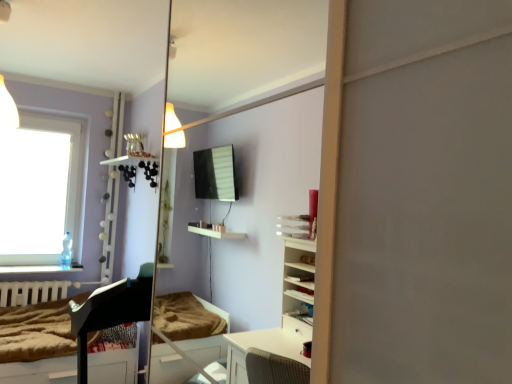
At what (x,y) coordinates should I click in order to perform the action: click on clear glass window at upper left. Please return your answer as a coordinate pair (x, y). The height and width of the screenshot is (384, 512). Looking at the image, I should click on click(42, 191).

Locate an element on the screen. brown textured mattress at lower left is located at coordinates (37, 331).

Describe the element at coordinates (87, 334) in the screenshot. I see `black glossy piano at lower left` at that location.

The width and height of the screenshot is (512, 384). Identify the location of clear glass window at upper left. pyautogui.click(x=42, y=191).

Between black glossy piano at lower left and brown textured mattress at lower left, which one appears on the right side from the viewer's perspective?

From the viewer's perspective, black glossy piano at lower left appears more on the right side.

Measure the distance from black glossy piano at lower left to brown textured mattress at lower left.

14.58 inches.

Would you say black glossy piano at lower left is outside brown textured mattress at lower left?

No.

From a real-world perspective, is brown textured mattress at lower left above or below white matte radiator at lower left?

In terms of real-world spatial position, brown textured mattress at lower left is below white matte radiator at lower left.

The width and height of the screenshot is (512, 384). I want to click on radiator behind the brown textured mattress at lower left, so click(x=33, y=292).

Considering the positions of point (38, 306) and point (13, 304), is point (38, 306) closer or farther from the camera than point (13, 304)?

Point (38, 306) is farther from the camera than point (13, 304).

How far apart are brown textured mattress at lower left and white matte radiator at lower left?

brown textured mattress at lower left and white matte radiator at lower left are 12.08 inches apart from each other.

Based on the photo, does white matte radiator at lower left have a greater height compared to clear glass window at upper left?

No.

From a real-world perspective, which object rests below the other?

white matte radiator at lower left is physically lower.

From the image's perspective, is white matte radiator at lower left above clear glass window at upper left?

No, from the image's perspective, white matte radiator at lower left is not on top of clear glass window at upper left.

Could clear glass window at upper left be considered to be inside white matte radiator at lower left?

No.

Where is `mattress that appears below the clear glass window at upper left (from the image's perspective)`? Image resolution: width=512 pixels, height=384 pixels. mattress that appears below the clear glass window at upper left (from the image's perspective) is located at coordinates (37, 331).

What's the angular difference between clear glass window at upper left and brown textured mattress at lower left's facing directions?

clear glass window at upper left and brown textured mattress at lower left are facing 1.07 degrees away from each other.

Are clear glass window at upper left and brown textured mattress at lower left making contact?

No.

Is point (71, 171) positioned after point (10, 348)?

Yes.

Which of these two, brown textured mattress at lower left or black glossy piano at lower left, is thinner?

black glossy piano at lower left.

Considering the positions of objects brown textured mattress at lower left and black glossy piano at lower left in the image provided, who is more to the right, brown textured mattress at lower left or black glossy piano at lower left?

Positioned to the right is black glossy piano at lower left.

Does brown textured mattress at lower left have a greater height compared to black glossy piano at lower left?

In fact, brown textured mattress at lower left may be shorter than black glossy piano at lower left.

Between brown textured mattress at lower left and black glossy piano at lower left, which one has larger size?

black glossy piano at lower left.

How many degrees apart are the facing directions of white matte radiator at lower left and brown textured mattress at lower left?

1.18 degrees.

From a real-world perspective, which is physically above, white matte radiator at lower left or brown textured mattress at lower left?

From a 3D spatial view, white matte radiator at lower left is above.

In the image, is white matte radiator at lower left positioned in front of or behind brown textured mattress at lower left?

white matte radiator at lower left is positioned farther from the viewer than brown textured mattress at lower left.

From the image's perspective, is white matte radiator at lower left located above brown textured mattress at lower left?

Yes, from the image's perspective, white matte radiator at lower left is on top of brown textured mattress at lower left.

Is brown textured mattress at lower left looking in the opposite direction of clear glass window at upper left?

No, clear glass window at upper left is not at the back of brown textured mattress at lower left.

Considering the positions of objects brown textured mattress at lower left and clear glass window at upper left in the image provided, who is behind, brown textured mattress at lower left or clear glass window at upper left?

clear glass window at upper left is further from the camera.

From the picture: Can you confirm if brown textured mattress at lower left is thinner than clear glass window at upper left?

No.

Based on the photo, can you confirm if brown textured mattress at lower left is shorter than clear glass window at upper left?

Indeed, brown textured mattress at lower left has a lesser height compared to clear glass window at upper left.

I want to click on mattress that is above the black glossy piano at lower left (from the image's perspective), so click(x=37, y=331).

Locate an element on the screen. The image size is (512, 384). mattress lying below the white matte radiator at lower left (from the image's perspective) is located at coordinates (37, 331).

Considering their positions, is black glossy piano at lower left positioned further to brown textured mattress at lower left than white matte radiator at lower left?

Among the two, black glossy piano at lower left is located further to brown textured mattress at lower left.

Which object lies further to the anchor point white matte radiator at lower left, clear glass window at upper left or black glossy piano at lower left?

black glossy piano at lower left is positioned further to the anchor white matte radiator at lower left.

Based on the photo, which object lies nearer to the anchor point white matte radiator at lower left, black glossy piano at lower left or brown textured mattress at lower left?

Based on the image, brown textured mattress at lower left appears to be nearer to white matte radiator at lower left.

From the image, which object appears to be nearer to brown textured mattress at lower left, black glossy piano at lower left or clear glass window at upper left?

black glossy piano at lower left.

When comparing their distances from black glossy piano at lower left, does brown textured mattress at lower left or clear glass window at upper left seem further?

Based on the image, clear glass window at upper left appears to be further to black glossy piano at lower left.

Based on their spatial positions, is white matte radiator at lower left or brown textured mattress at lower left closer to clear glass window at upper left?

white matte radiator at lower left is positioned closer to the anchor clear glass window at upper left.

Looking at this image, looking at the image, which one is located closer to clear glass window at upper left, white matte radiator at lower left or black glossy piano at lower left?

Among the two, white matte radiator at lower left is located nearer to clear glass window at upper left.

From the image, which object appears to be farther from black glossy piano at lower left, clear glass window at upper left or white matte radiator at lower left?

Based on the image, clear glass window at upper left appears to be further to black glossy piano at lower left.

Where is `radiator between clear glass window at upper left and black glossy piano at lower left vertically`? radiator between clear glass window at upper left and black glossy piano at lower left vertically is located at coordinates (33, 292).

This screenshot has width=512, height=384. Identify the location of radiator between clear glass window at upper left and brown textured mattress at lower left from top to bottom. (33, 292).

Locate an element on the screen. mattress between clear glass window at upper left and black glossy piano at lower left in the up-down direction is located at coordinates (37, 331).

Where is `mattress positioned between black glossy piano at lower left and white matte radiator at lower left from near to far`? mattress positioned between black glossy piano at lower left and white matte radiator at lower left from near to far is located at coordinates (37, 331).